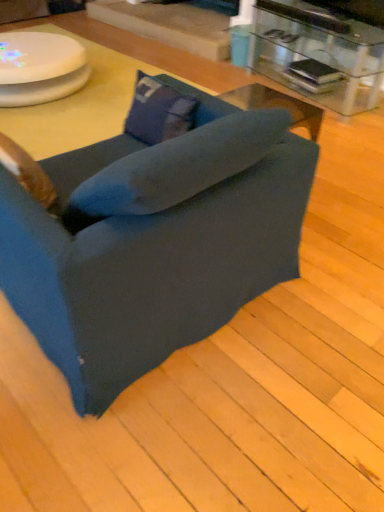
Question: Is dark blue fabric chair at center to the left of transparent glass table at upper right from the viewer's perspective?

Choices:
 (A) no
 (B) yes

Answer: (B)

Question: From a real-world perspective, is dark blue fabric chair at center located beneath transparent glass table at upper right?

Choices:
 (A) no
 (B) yes

Answer: (A)

Question: Does dark blue fabric chair at center have a larger size compared to transparent glass table at upper right?

Choices:
 (A) no
 (B) yes

Answer: (B)

Question: Considering the relative positions of dark blue fabric chair at center and transparent glass table at upper right in the image provided, is dark blue fabric chair at center to the right of transparent glass table at upper right from the viewer's perspective?

Choices:
 (A) yes
 (B) no

Answer: (B)

Question: Is dark blue fabric chair at center looking in the opposite direction of transparent glass table at upper right?

Choices:
 (A) no
 (B) yes

Answer: (A)

Question: Could you tell me if dark blue fabric chair at center is facing transparent glass table at upper right?

Choices:
 (A) no
 (B) yes

Answer: (A)

Question: Does white glossy round table at upper left have a greater height compared to transparent glass table at upper right?

Choices:
 (A) no
 (B) yes

Answer: (A)

Question: Is white glossy round table at upper left positioned behind transparent glass table at upper right?

Choices:
 (A) yes
 (B) no

Answer: (A)

Question: Is white glossy round table at upper left in front of transparent glass table at upper right?

Choices:
 (A) no
 (B) yes

Answer: (A)

Question: From a real-world perspective, is white glossy round table at upper left under transparent glass table at upper right?

Choices:
 (A) yes
 (B) no

Answer: (A)

Question: Does white glossy round table at upper left turn towards transparent glass table at upper right?

Choices:
 (A) no
 (B) yes

Answer: (A)

Question: From a real-world perspective, is white glossy round table at upper left on top of transparent glass table at upper right?

Choices:
 (A) yes
 (B) no

Answer: (B)

Question: Does white glossy round table at upper left have a greater width compared to blue fabric pillow at center?

Choices:
 (A) no
 (B) yes

Answer: (B)